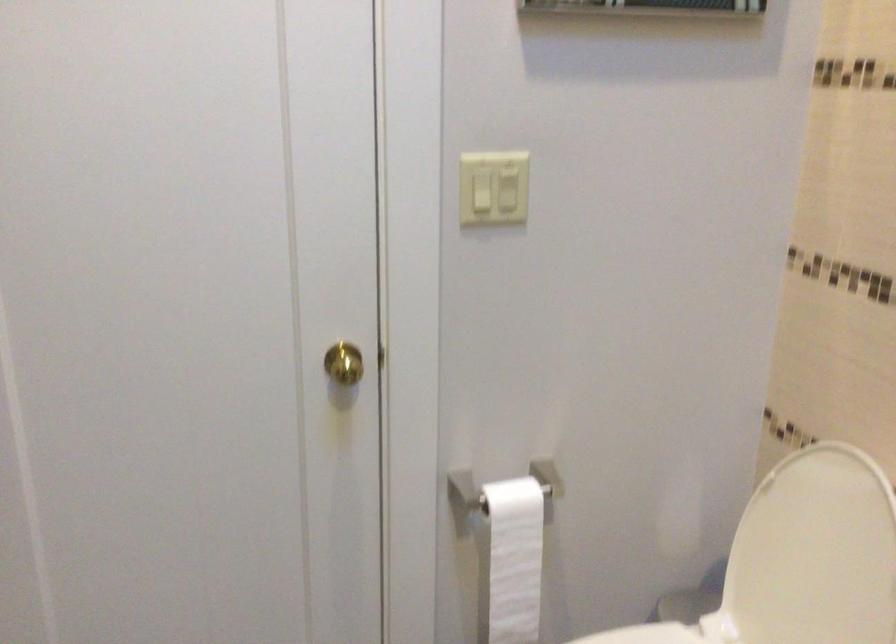
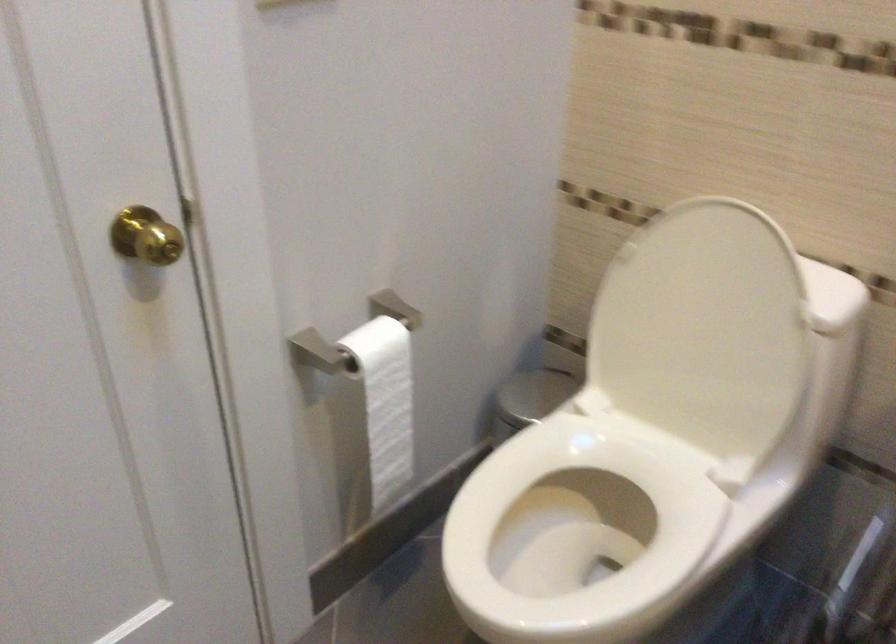
Find the pixel in the second image that matches pixel 510 552 in the first image.

(385, 402)